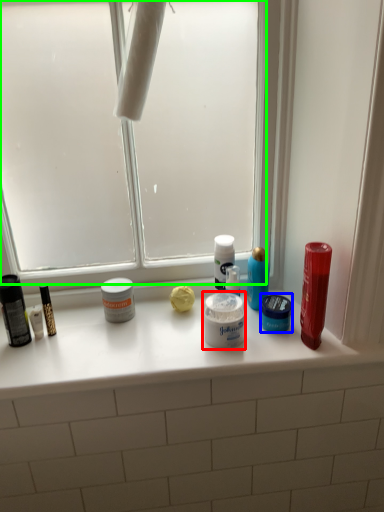
Question: Considering the real-world distances, which object is closest to cream (highlighted by a red box)? toiletry (highlighted by a blue box) or window screen (highlighted by a green box).

Choices:
 (A) toiletry
 (B) window screen

Answer: (A)